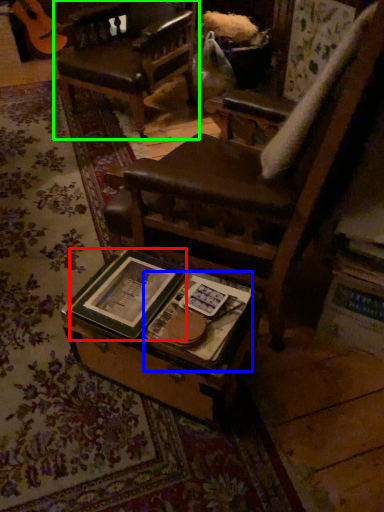
Question: Which object is the closest to the paperback book (highlighted by a red box)? Choose among these: paperback book (highlighted by a blue box) or chair (highlighted by a green box).

Choices:
 (A) paperback book
 (B) chair

Answer: (A)